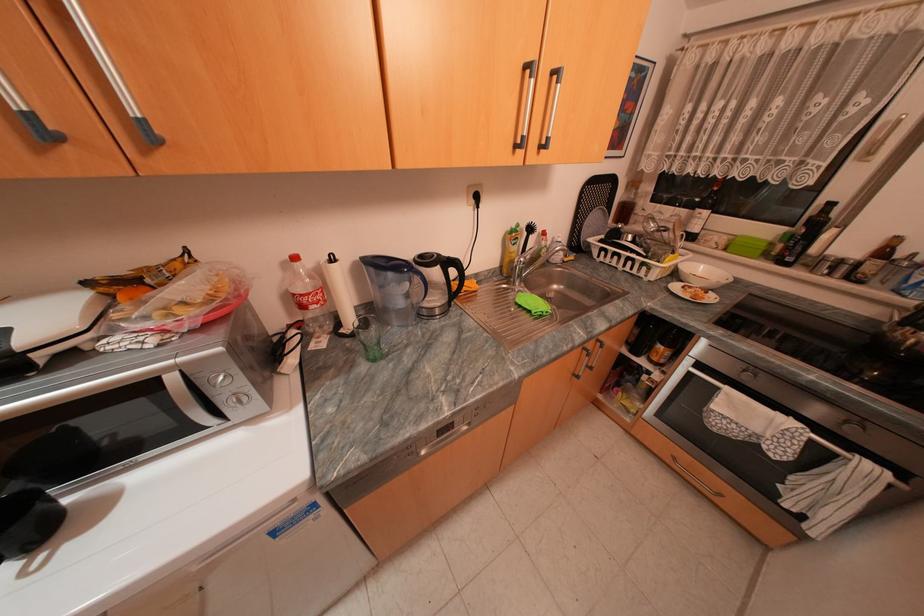
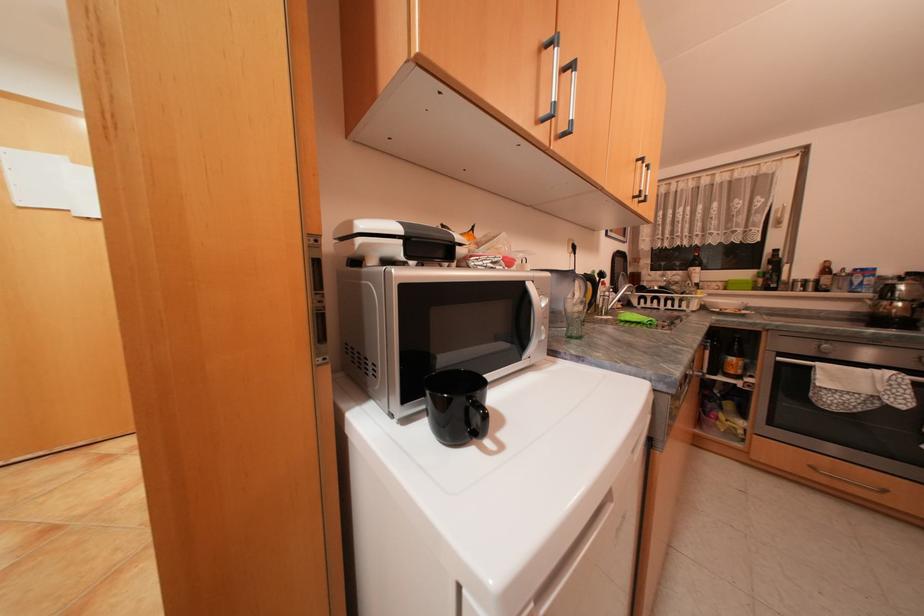
The point at [736,387] is marked in the first image. Where is the corresponding point in the second image?

(830, 363)